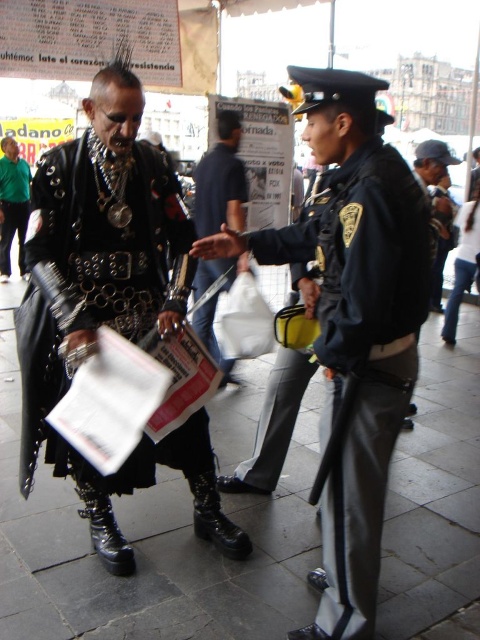
Question: Can you confirm if dark blue jeans at center is positioned below matte black leather jacket at left?

Choices:
 (A) no
 (B) yes

Answer: (B)

Question: Is dark blue uniform at center positioned behind matte black leather jacket at left?

Choices:
 (A) yes
 (B) no

Answer: (B)

Question: Which of these objects is positioned farthest from the matte black leather jacket at left?

Choices:
 (A) dark blue uniform at center
 (B) leather jacket at center
 (C) dark blue jeans at center

Answer: (A)

Question: Which object is the closest to the dark blue jeans at center?

Choices:
 (A) matte black leather jacket at left
 (B) dark blue uniform at center

Answer: (B)

Question: Which object is the closest to the leather jacket at center?

Choices:
 (A) dark blue uniform at center
 (B) dark blue jeans at center

Answer: (A)

Question: Is leather jacket at center below dark blue jeans at center?

Choices:
 (A) no
 (B) yes

Answer: (B)